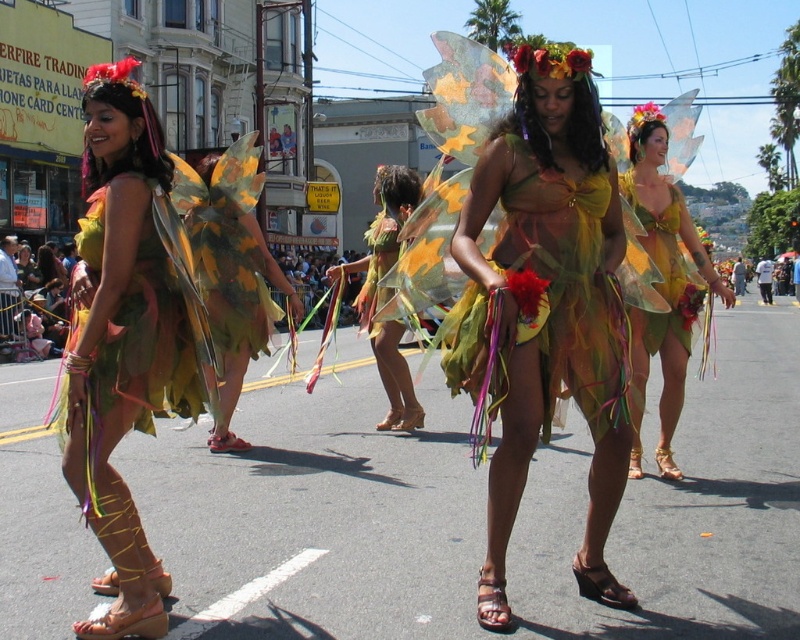
Can you confirm if matte green fabric dress at center is positioned to the right of multicolored fabric wings at left?

Correct, you'll find matte green fabric dress at center to the right of multicolored fabric wings at left.

Based on the photo, can you confirm if matte green fabric dress at center is wider than multicolored fabric wings at left?

No, matte green fabric dress at center is not wider than multicolored fabric wings at left.

Which is in front, point (148, 310) or point (78, 308)?

Positioned in front is point (148, 310).

You are a GUI agent. You are given a task and a screenshot of the screen. Output one action in this format:
    pyautogui.click(x=<x>, y=<y>)
    Task: Click on the matte green fabric dress at center
    
    Given the screenshot: What is the action you would take?
    pyautogui.click(x=126, y=339)

Does matte yellow fairy wings at center have a lesser height compared to shiny gold leaf wings at center?

In fact, matte yellow fairy wings at center may be taller than shiny gold leaf wings at center.

Who is more forward, (688, 326) or (682, 323)?

Point (682, 323)

Describe the element at coordinates (664, 282) in the screenshot. I see `matte yellow fairy wings at center` at that location.

What are the coordinates of `matte yellow fairy wings at center` in the screenshot? It's located at (664, 282).

Does matte yellow fairy wings at center have a smaller size compared to translucent yellow-green wings at center?

No.

Who is shorter, matte yellow fairy wings at center or translucent yellow-green wings at center?

translucent yellow-green wings at center

Where is `matte yellow fairy wings at center`? This screenshot has width=800, height=640. matte yellow fairy wings at center is located at coordinates (664, 282).